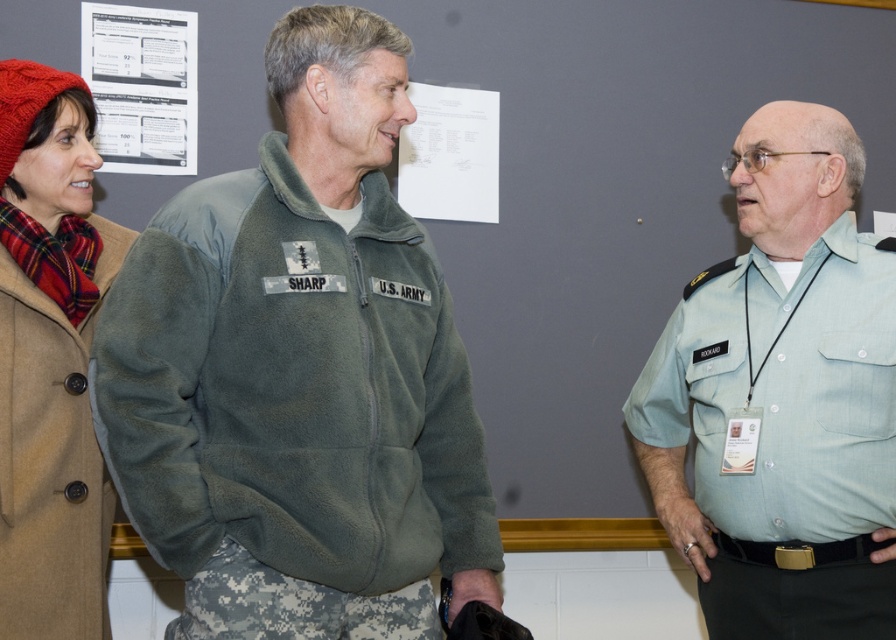
You are a delivery person who needs to place a small package between the green fleece jacket at center and the white paper at upper left. Can you fit it there?

The distance between the green fleece jacket at center and the white paper at upper left is 34.65 inches, so yes, the package can be placed there as there is enough space.

You are standing in the room and want to reach both the point at (x=877, y=349) and the point at (x=154, y=160). Which point will you reach first?

You will reach the point at (x=877, y=349) first because it is closer to you than the point at (x=154, y=160).